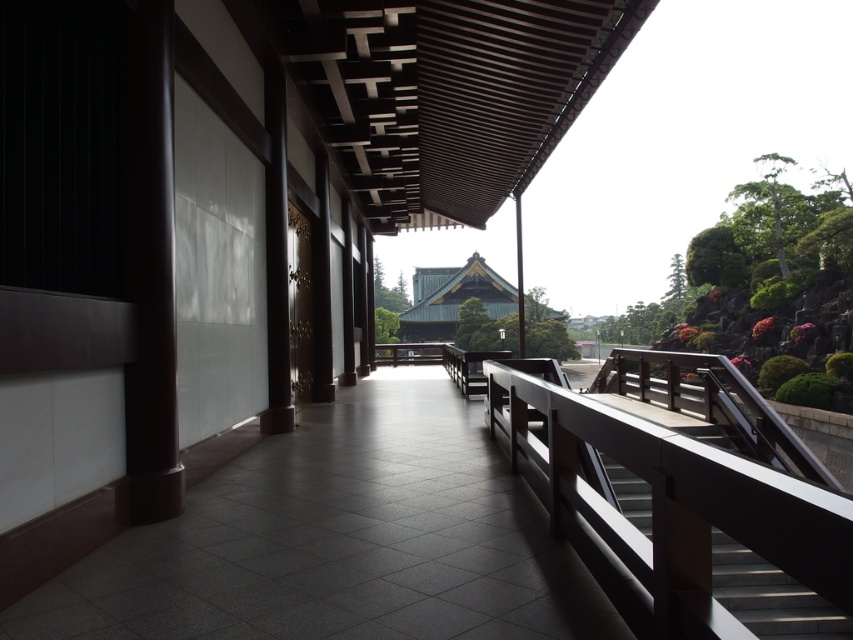
Question: Which of the following is the farthest from the observer?

Choices:
 (A) smooth wooden stair at center
 (B) smooth concrete path at center
 (C) smooth brown wooden rail at right

Answer: (A)

Question: Is smooth concrete path at center bigger than smooth brown wooden rail at right?

Choices:
 (A) yes
 (B) no

Answer: (B)

Question: Does smooth brown wooden rail at right have a smaller size compared to smooth wooden stair at center?

Choices:
 (A) no
 (B) yes

Answer: (A)

Question: Which object appears closest to the camera in this image?

Choices:
 (A) smooth concrete path at center
 (B) smooth wooden stair at center

Answer: (A)

Question: From the image, what is the correct spatial relationship of smooth concrete path at center in relation to smooth brown wooden rail at right?

Choices:
 (A) left
 (B) right

Answer: (A)

Question: Which point appears closest to the camera in this image?

Choices:
 (A) (758, 612)
 (B) (709, 470)
 (C) (393, 616)

Answer: (B)